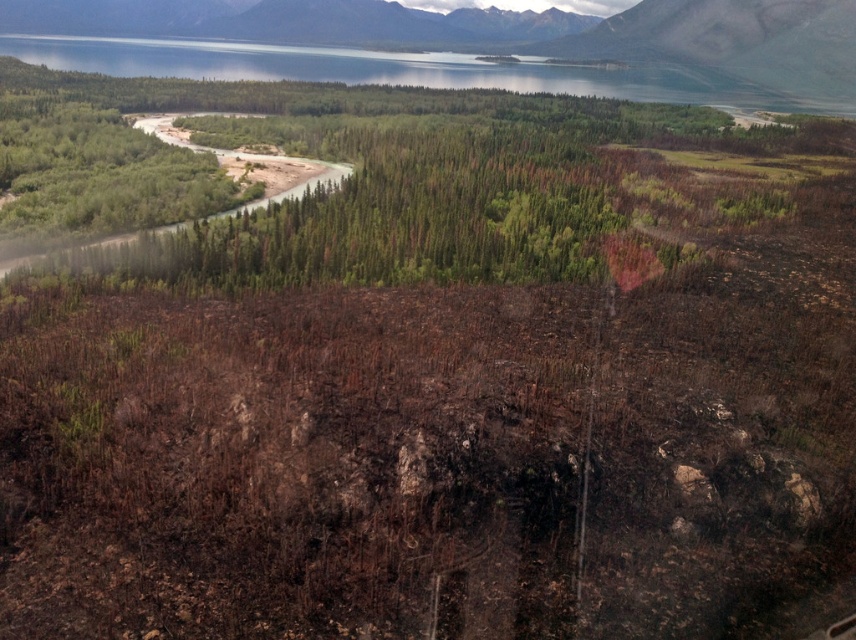
Can you confirm if green matte forest at upper center is wider than brown textured ground at upper center?

Incorrect, green matte forest at upper center's width does not surpass brown textured ground at upper center's.

Does green matte forest at upper center appear on the right side of brown textured ground at upper center?

Incorrect, green matte forest at upper center is not on the right side of brown textured ground at upper center.

The width and height of the screenshot is (856, 640). What are the coordinates of `green matte forest at upper center` in the screenshot? It's located at (399, 182).